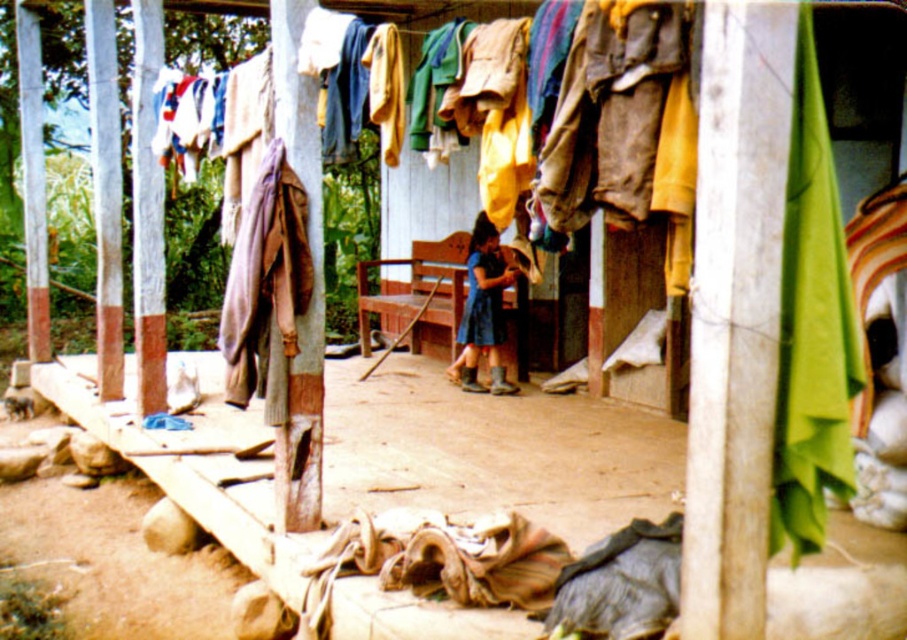
You are helping to hang laundry in this rustic outdoor setting. You have a knitted wool sweater at center and a blue denim dress at center. Which item is shorter in height?

The knitted wool sweater at center is not as tall as the blue denim dress at center, so the knitted wool sweater at center is shorter in height.

You are helping to organize the clothes in the rustic outdoor setting. You see the blue denim dress at center and the blue fabric dress at center. Which one is located to the right of the other?

The blue denim dress at center is positioned on the right side of blue fabric dress at center.

You are trying to organize the clothes on the drying rack. The blue denim dress at center and the blue fabric dress at center are too close to each other. What is the minimum distance you need to move them apart so they won

The blue denim dress at center and the blue fabric dress at center are currently 3.23 inches apart. To ensure proper airflow between them, you should move them at least 3.23 inches further apart so they are spaced adequately.